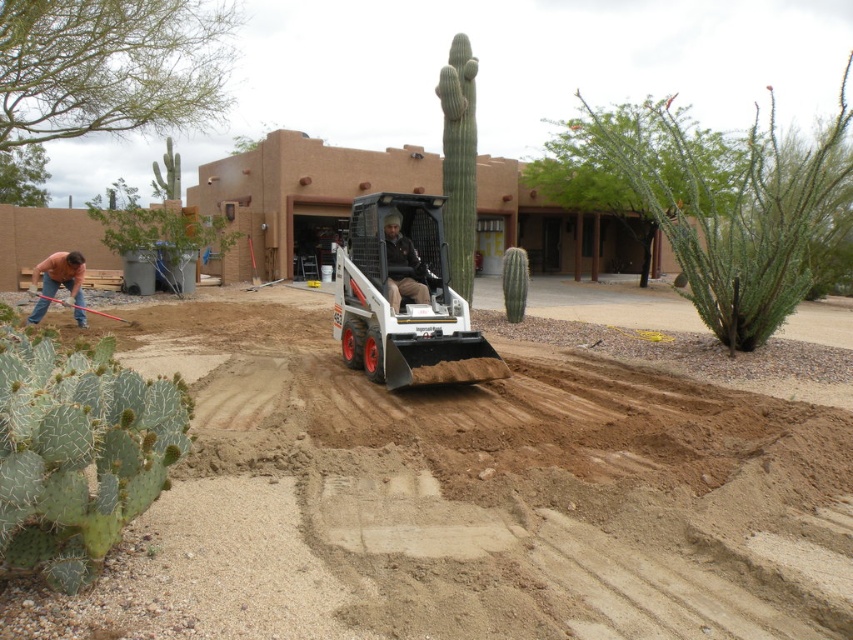
You are a contractor trying to assess the equipment and personnel in the scene. Which object is bigger between the white rubber skid steer loader at center and the dark brown leather jacket at center?

The white rubber skid steer loader at center is larger in size than the dark brown leather jacket at center.

You are a construction worker standing at the edge of the dirt area. You need to move the dark brown leather jacket at center to a safer location away from the machinery. Can you walk directly from your current position to the jacket without stepping on the brown gravel at center?

The brown gravel at center is closer to the viewer than dark brown leather jacket at center, so you would have to step over the gravel to reach the jacket. Therefore, you cannot walk directly to the jacket without stepping on the gravel.

You are a safety inspector assessing the construction site. You notice the white rubber skid steer loader at center and the dark brown leather jacket at center. Which object is wider?

The white rubber skid steer loader at center is wider than the dark brown leather jacket at center.